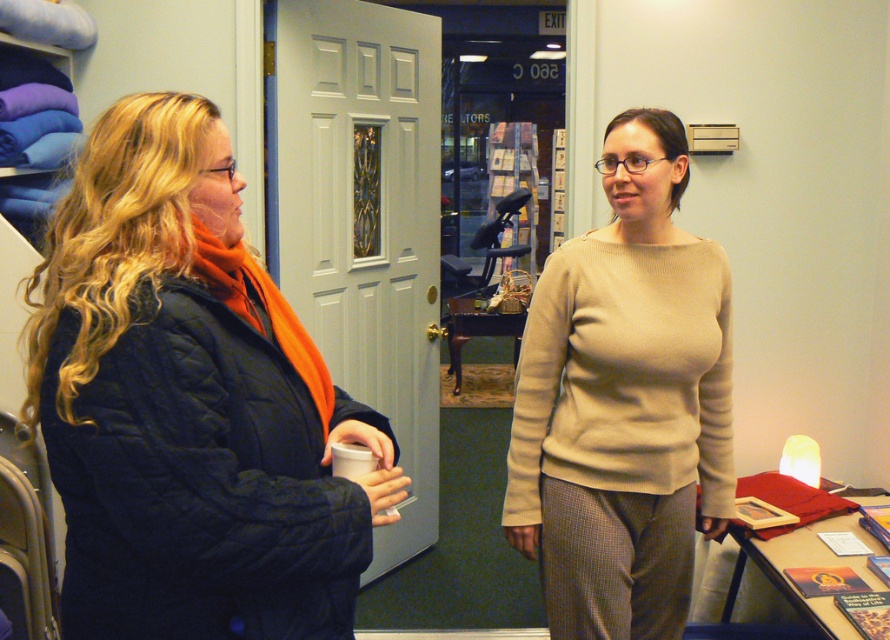
You are organizing a coat rack and need to place the matte black coat at left and the beige sweater at center. According to the image, which item should be placed higher on the rack?

The matte black coat at left should be placed higher on the rack because it is located above the beige sweater at center in the image.

You are standing in the room where the two people are talking. You need to move from point A at coordinates point [209,596] to point B at coordinates point [678,499]. Which direction should you face to walk towards point B from point A?

To move from point A at coordinates point [209,596] to point B at coordinates point [678,499], you should face towards the upper left direction since point B is located above and to the left of point A.

You are a delivery person holding a package that requires a space of 1.2 meters to place. You see the matte black coat at left and the beige sweater at center. Can you determine if the space between them is sufficient to place your package?

The matte black coat at left is wider than the beige sweater at center, so the space between them may be sufficient to place the package if the width of the coat allows enough space. However, without exact measurements, it is uncertain. Please check the actual dimensions before placing the package.